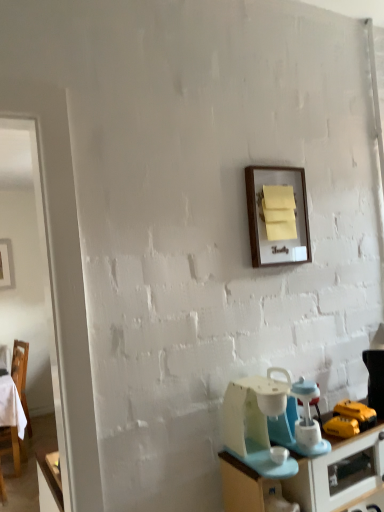
Question: From a real-world perspective, is light blue plastic blender at lower right located beneath matte blue desk at lower right?

Choices:
 (A) yes
 (B) no

Answer: (B)

Question: Is light blue plastic blender at lower right at the left side of matte blue desk at lower right?

Choices:
 (A) yes
 (B) no

Answer: (A)

Question: Does light blue plastic blender at lower right have a lesser height compared to matte blue desk at lower right?

Choices:
 (A) yes
 (B) no

Answer: (A)

Question: Can you confirm if light blue plastic blender at lower right is taller than matte blue desk at lower right?

Choices:
 (A) no
 (B) yes

Answer: (A)

Question: Is the position of light blue plastic blender at lower right more distant than that of matte blue desk at lower right?

Choices:
 (A) yes
 (B) no

Answer: (A)

Question: From a real-world perspective, is light blue plastic blender at lower right positioned above or below wooden chair at left?

Choices:
 (A) below
 (B) above

Answer: (B)

Question: Considering their positions, is light blue plastic blender at lower right located in front of or behind wooden chair at left?

Choices:
 (A) behind
 (B) front

Answer: (B)

Question: Is light blue plastic blender at lower right inside the boundaries of wooden chair at left, or outside?

Choices:
 (A) outside
 (B) inside

Answer: (A)

Question: Considering the positions of light blue plastic blender at lower right and wooden chair at left in the image, is light blue plastic blender at lower right wider or thinner than wooden chair at left?

Choices:
 (A) thin
 (B) wide

Answer: (A)

Question: From the image's perspective, is matte blue desk at lower right located above or below wooden frame at upper center?

Choices:
 (A) above
 (B) below

Answer: (B)

Question: Considering the positions of matte blue desk at lower right and wooden frame at upper center in the image, is matte blue desk at lower right bigger or smaller than wooden frame at upper center?

Choices:
 (A) big
 (B) small

Answer: (A)

Question: From a real-world perspective, is matte blue desk at lower right positioned above or below wooden frame at upper center?

Choices:
 (A) below
 (B) above

Answer: (A)

Question: Based on their positions, is matte blue desk at lower right located to the left or right of wooden frame at upper center?

Choices:
 (A) right
 (B) left

Answer: (A)

Question: Is light blue plastic blender at lower right in front of or behind wooden frame at upper center in the image?

Choices:
 (A) front
 (B) behind

Answer: (A)

Question: From their relative heights in the image, would you say light blue plastic blender at lower right is taller or shorter than wooden frame at upper center?

Choices:
 (A) tall
 (B) short

Answer: (B)